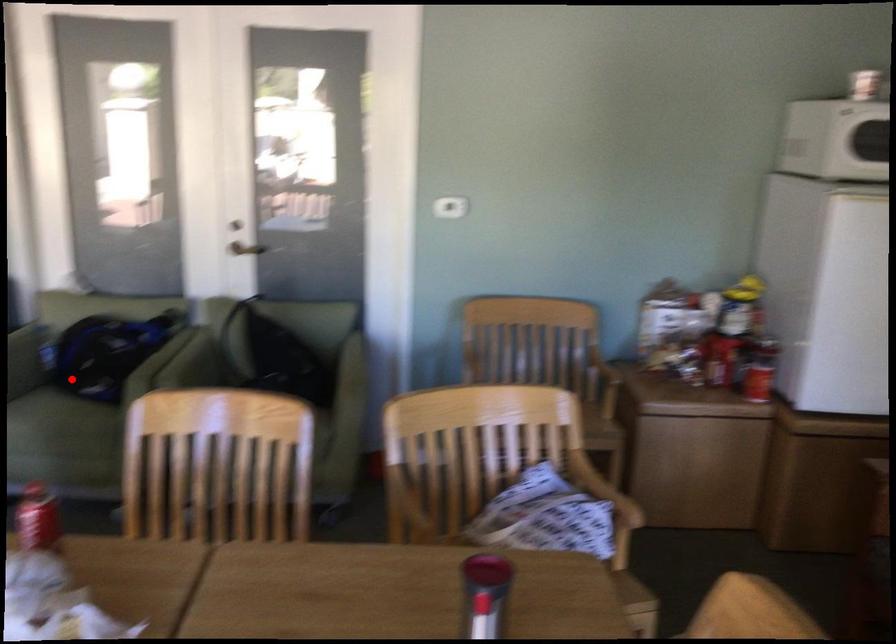
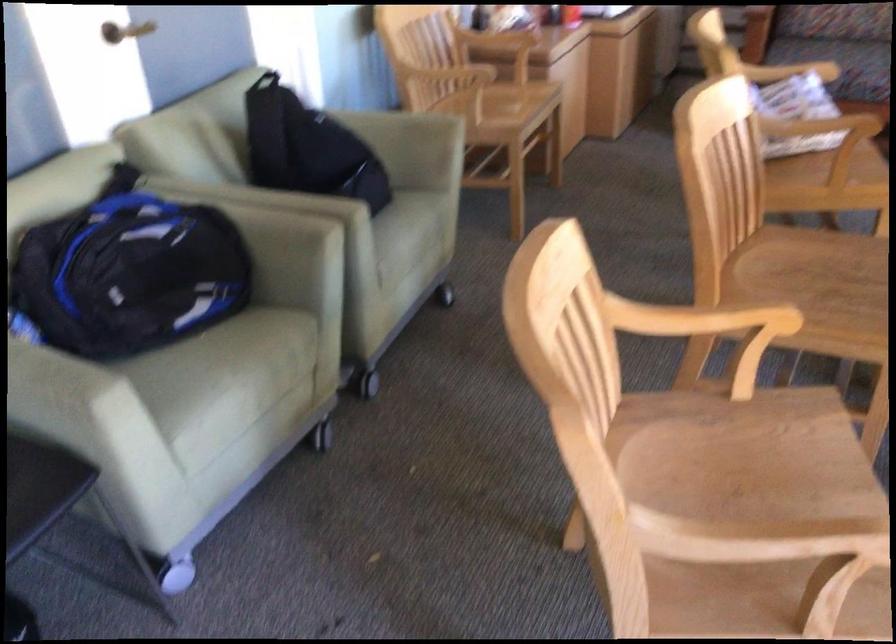
Find the pixel in the second image that matches the highlighted location in the first image.

(126, 315)